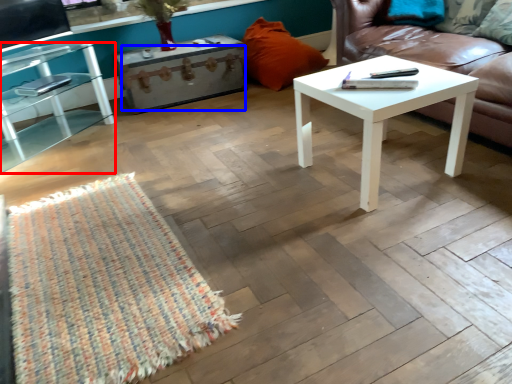
Question: Which point is further to the camera, table (highlighted by a red box) or drawer (highlighted by a blue box)?

Choices:
 (A) table
 (B) drawer

Answer: (B)